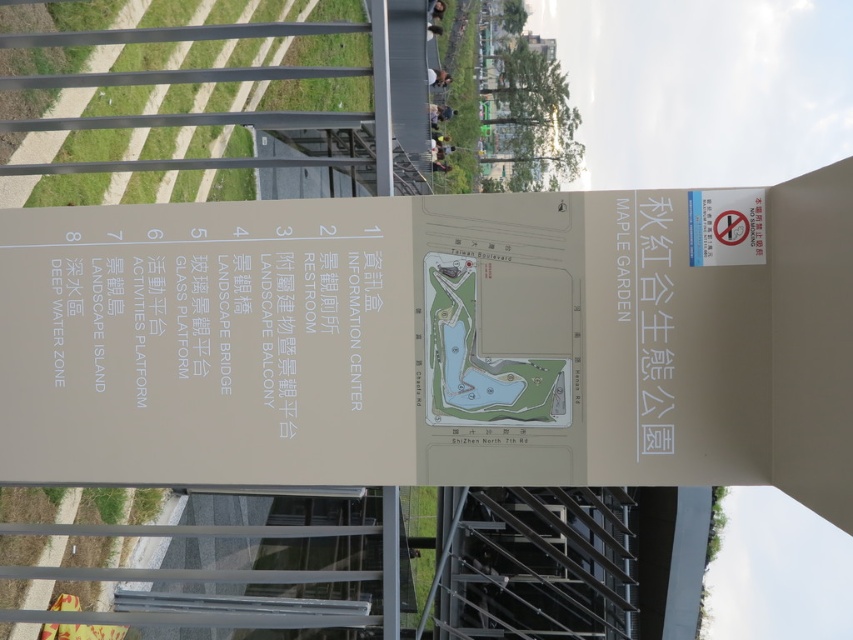
Question: Does white matte sign at center have a lesser width compared to white matte information center at upper center?

Choices:
 (A) yes
 (B) no

Answer: (B)

Question: Which point is closer to the camera?

Choices:
 (A) (135, 340)
 (B) (178, 259)

Answer: (B)

Question: Is white matte sign at center above white matte information center at upper center?

Choices:
 (A) yes
 (B) no

Answer: (A)

Question: From the image, what is the correct spatial relationship of white matte sign at center in relation to white matte information center at upper center?

Choices:
 (A) below
 (B) above

Answer: (B)